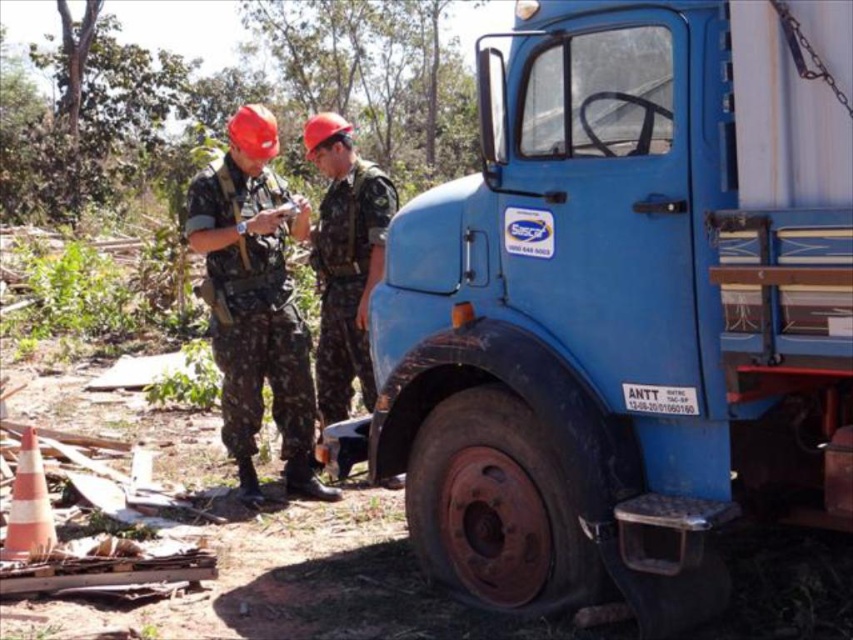
Question: Based on their relative distances, which object is farther from the camouflage fabric uniform at center?

Choices:
 (A) camouflage fabric uniform at left
 (B) blue matte truck at center

Answer: (B)

Question: Considering the relative positions of blue matte truck at center and camouflage fabric uniform at center in the image provided, where is blue matte truck at center located with respect to camouflage fabric uniform at center?

Choices:
 (A) below
 (B) above

Answer: (A)

Question: Is blue matte truck at center to the right of camouflage fabric uniform at left from the viewer's perspective?

Choices:
 (A) yes
 (B) no

Answer: (A)

Question: Which point is farther from the camera taking this photo?

Choices:
 (A) (335, 355)
 (B) (399, 376)
 (C) (299, 353)

Answer: (A)

Question: Among these objects, which one is farthest from the camera?

Choices:
 (A) blue matte truck at center
 (B) camouflage fabric uniform at center

Answer: (B)

Question: Does blue matte truck at center appear over camouflage fabric uniform at left?

Choices:
 (A) yes
 (B) no

Answer: (B)